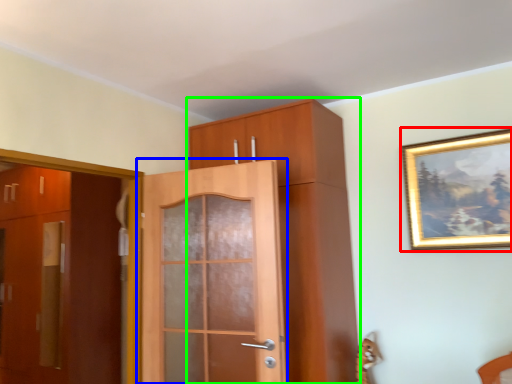
Question: Estimate the real-world distances between objects in this image. Which object is farther from picture frame (highlighted by a red box), door (highlighted by a blue box) or cabinetry (highlighted by a green box)?

Choices:
 (A) door
 (B) cabinetry

Answer: (A)